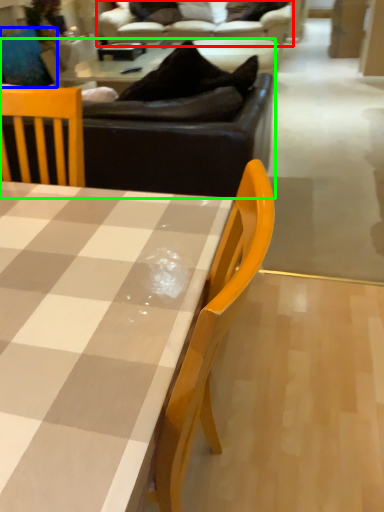
Question: Which object is the farthest from studio couch (highlighted by a red box)? Choose among these: swivel chair (highlighted by a blue box) or studio couch (highlighted by a green box).

Choices:
 (A) swivel chair
 (B) studio couch

Answer: (B)